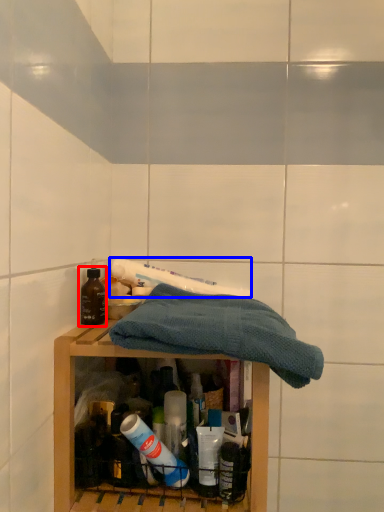
Question: Which of the following is the closest to the observer, bottle (highlighted by a red box) or toothpaste (highlighted by a blue box)?

Choices:
 (A) bottle
 (B) toothpaste

Answer: (A)